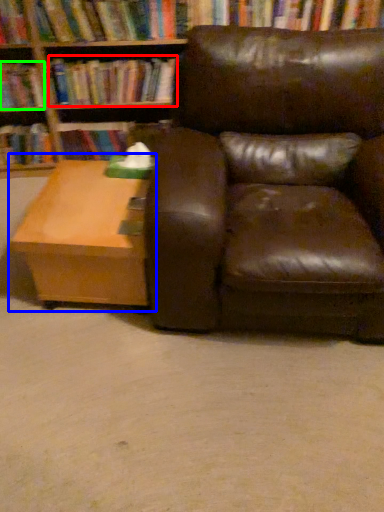
Question: Considering the real-world distances, which object is farthest from book (highlighted by a red box)? table (highlighted by a blue box) or book (highlighted by a green box)?

Choices:
 (A) table
 (B) book

Answer: (A)